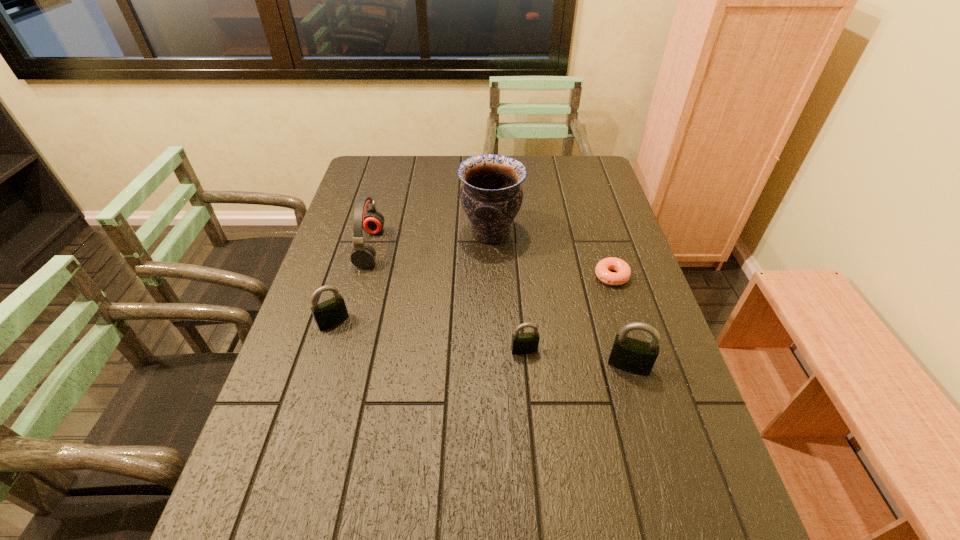
Identify the location of free spot between the pottery and the rightmost padlock. The height and width of the screenshot is (540, 960). (560, 299).

You are a GUI agent. You are given a task and a screenshot of the screen. Output one action in this format:
    pyautogui.click(x=<x>, y=<y>)
    Task: Click on the free space between the tallest object and the shortest object
    This screenshot has height=540, width=960.
    Given the screenshot: What is the action you would take?
    pyautogui.click(x=551, y=254)

Identify the location of free point between the tallest padlock and the earphone. Image resolution: width=960 pixels, height=540 pixels. (499, 307).

Identify the location of unoccupied area between the farthest padlock and the earphone. (351, 285).

Identify the location of blank region between the second farthest padlock and the farthest padlock. This screenshot has height=540, width=960. (429, 336).

Where is `vacant area that lies between the doughnut and the second padlock from right to left`? vacant area that lies between the doughnut and the second padlock from right to left is located at coordinates (568, 313).

At what (x,y) coordinates should I click in order to perform the action: click on blank region between the farthest padlock and the rightmost padlock. Please return your answer as a coordinate pair (x, y). The height and width of the screenshot is (540, 960). Looking at the image, I should click on (481, 343).

Where is `object that is the fifth nearest to the second nearest object`? object that is the fifth nearest to the second nearest object is located at coordinates tap(363, 255).

Locate an element on the screen. object that is the closest to the third shortest object is located at coordinates (363, 255).

Find the location of a particular element. the second closest padlock to the earphone is located at coordinates (522, 343).